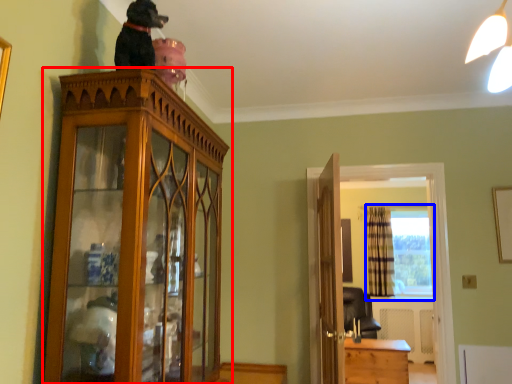
Question: Which point is closer to the camera, cabinetry (highlighted by a red box) or window (highlighted by a blue box)?

Choices:
 (A) cabinetry
 (B) window

Answer: (A)